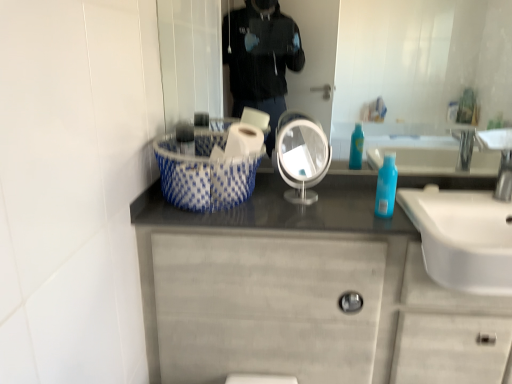
Question: Which direction should I rotate to look at matte silver mirror at center, marked as the first mirror in a right-to-left arrangement?

Choices:
 (A) right
 (B) left

Answer: (A)

Question: From a real-world perspective, does white glossy sink at right sit lower than matte silver mirror at center, which is the second mirror in left-to-right order?

Choices:
 (A) yes
 (B) no

Answer: (A)

Question: From the image's perspective, is white glossy sink at right on top of matte silver mirror at center, which is the second mirror in left-to-right order?

Choices:
 (A) yes
 (B) no

Answer: (B)

Question: Is white glossy sink at right next to matte silver mirror at center, which is the second mirror in left-to-right order, and touching it?

Choices:
 (A) yes
 (B) no

Answer: (B)

Question: Considering the relative sizes of white glossy sink at right and matte silver mirror at center, which is the second mirror in left-to-right order, in the image provided, is white glossy sink at right taller than matte silver mirror at center, which is the second mirror in left-to-right order,?

Choices:
 (A) yes
 (B) no

Answer: (B)

Question: Is white glossy sink at right outside of matte silver mirror at center, marked as the first mirror in a right-to-left arrangement?

Choices:
 (A) no
 (B) yes

Answer: (B)

Question: Is white glossy sink at right positioned with its back to matte silver mirror at center, marked as the first mirror in a right-to-left arrangement?

Choices:
 (A) no
 (B) yes

Answer: (A)

Question: From a real-world perspective, is white glossy toilet paper at center beneath white glossy sink at right?

Choices:
 (A) no
 (B) yes

Answer: (A)

Question: From the image's perspective, is white glossy toilet paper at center located beneath white glossy sink at right?

Choices:
 (A) yes
 (B) no

Answer: (B)

Question: Does white glossy toilet paper at center have a lesser width compared to white glossy sink at right?

Choices:
 (A) no
 (B) yes

Answer: (B)

Question: Is the position of white glossy toilet paper at center more distant than that of white glossy sink at right?

Choices:
 (A) yes
 (B) no

Answer: (A)

Question: Can you confirm if white glossy toilet paper at center is positioned to the left of white glossy sink at right?

Choices:
 (A) yes
 (B) no

Answer: (A)

Question: Would you say white glossy toilet paper at center is a long distance from white glossy sink at right?

Choices:
 (A) no
 (B) yes

Answer: (A)

Question: Does matte silver mirror at center, which is the second mirror in left-to-right order, turn towards blue dotted fabric basket at center?

Choices:
 (A) no
 (B) yes

Answer: (B)